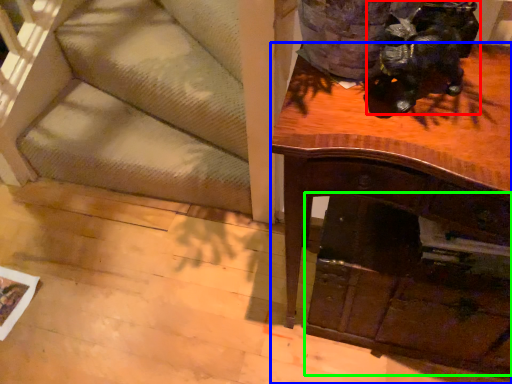
Question: Which is farther away from animal (highlighted by a red box)? desk (highlighted by a blue box) or drawer (highlighted by a green box)?

Choices:
 (A) desk
 (B) drawer

Answer: (B)